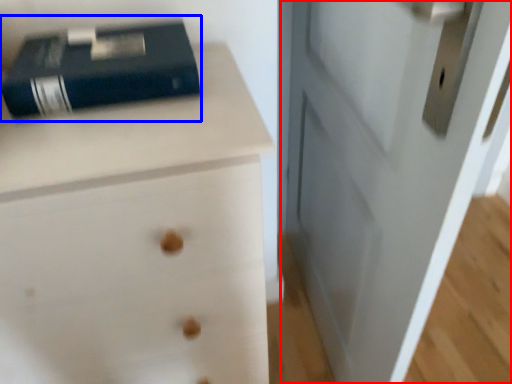
Question: Among these objects, which one is farthest to the camera, door (highlighted by a red box) or paperback book (highlighted by a blue box)?

Choices:
 (A) door
 (B) paperback book

Answer: (B)